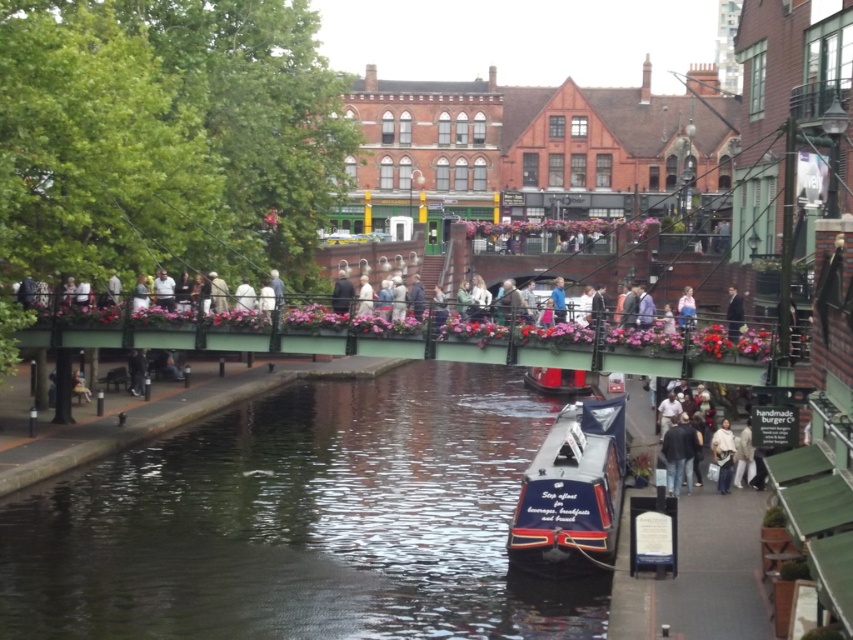
Question: Is shiny blue boat at center to the left of white fabric bag at lower right from the viewer's perspective?

Choices:
 (A) no
 (B) yes

Answer: (B)

Question: Is light brown leather jacket at center closer to camera compared to dark blue suit at center?

Choices:
 (A) no
 (B) yes

Answer: (A)

Question: Does blue polished wood boat at center have a greater width compared to light beige jacket at center?

Choices:
 (A) no
 (B) yes

Answer: (B)

Question: Among these objects, which one is nearest to the camera?

Choices:
 (A) white fabric bag at lower right
 (B) light beige jacket at center
 (C) dark gray jeans at lower right

Answer: (A)

Question: Which point is farther from the camera taking this photo?

Choices:
 (A) (699, 444)
 (B) (733, 307)
 (C) (503, 554)

Answer: (B)

Question: Among these points, which one is nearest to the camera?

Choices:
 (A) coord(670,444)
 (B) coord(335,312)
 (C) coord(749,448)

Answer: (C)